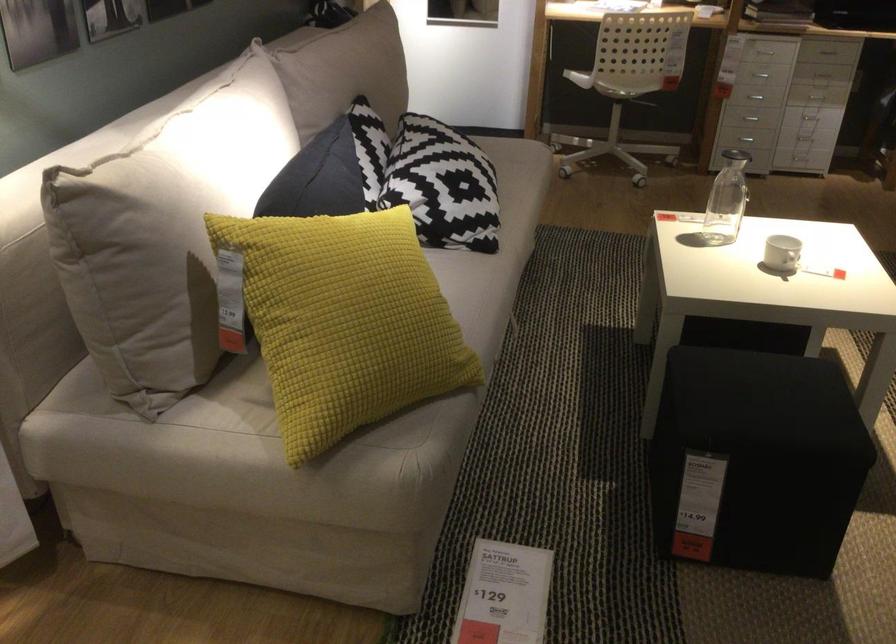
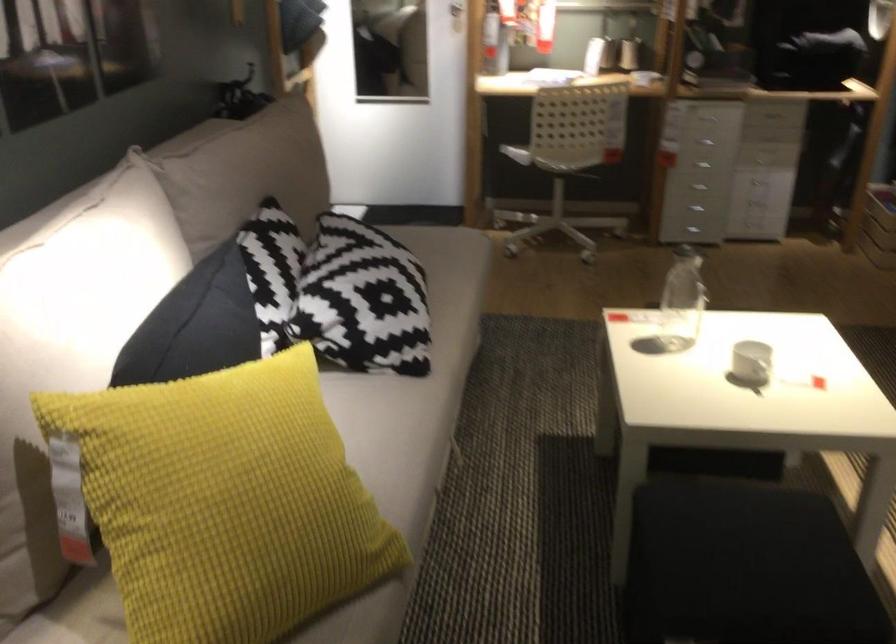
The images are taken continuously from a first-person perspective. In which direction are you moving?

The cameraman moved toward right, forward.